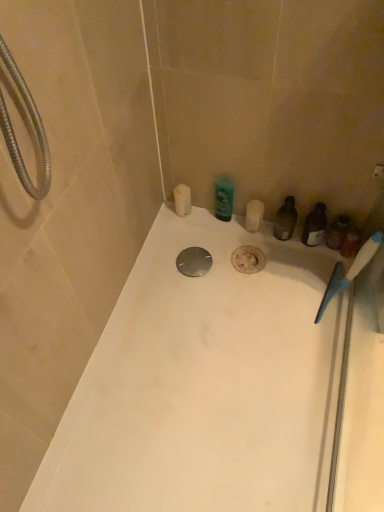
Question: From the image's perspective, relative to translucent plastic container at right, which is the 1th toiletry from right to left, is white glossy bathtub at center above or below?

Choices:
 (A) below
 (B) above

Answer: (A)

Question: Considering their positions, is white glossy bathtub at center located in front of or behind translucent plastic container at right, the 3th toiletry positioned from the left?

Choices:
 (A) behind
 (B) front

Answer: (B)

Question: Which of these objects is positioned closest to the green glossy bottle at center, acting as the second toiletry starting from the left?

Choices:
 (A) blue plastic toothbrush at right
 (B) translucent plastic container at right, the 3th toiletry positioned from the left
 (C) translucent plastic bottle at right
 (D) white glossy bathtub at center
 (E) white matte candle at upper left, the first toiletry from the left

Answer: (E)

Question: Estimate the real-world distances between objects in this image. Which object is farther from the blue plastic toothbrush at right?

Choices:
 (A) white glossy bathtub at center
 (B) translucent plastic container at right, which is the 1th toiletry from right to left
 (C) green glossy bottle at center, the second toiletry positioned from the right
 (D) white matte candle at upper left, placed as the 3th toiletry when sorted from right to left
 (E) translucent plastic bottle at right

Answer: (D)